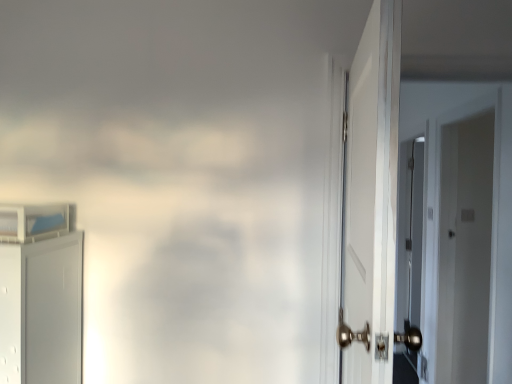
Question: Does white matte cabinet at left, the second door from the right, have a lesser width compared to white glossy door at right, the first door positioned from the right?

Choices:
 (A) yes
 (B) no

Answer: (B)

Question: Is white matte cabinet at left, the 1th door positioned from the left, smaller than white glossy door at right, which ranks as the 2th door in left-to-right order?

Choices:
 (A) no
 (B) yes

Answer: (B)

Question: Can you confirm if white matte cabinet at left, the 1th door positioned from the left, is positioned to the left of white glossy door at right, which ranks as the 2th door in left-to-right order?

Choices:
 (A) no
 (B) yes

Answer: (B)

Question: From a real-world perspective, is white matte cabinet at left, the second door from the right, below white glossy door at right, which ranks as the 2th door in left-to-right order?

Choices:
 (A) no
 (B) yes

Answer: (B)

Question: Can you confirm if white matte cabinet at left, the second door from the right, is bigger than white glossy door at right, which ranks as the 2th door in left-to-right order?

Choices:
 (A) yes
 (B) no

Answer: (B)

Question: Is white matte cabinet at left, the second door from the right, wider than white glossy door at right, the first door positioned from the right?

Choices:
 (A) yes
 (B) no

Answer: (A)

Question: From the image's perspective, is white glossy door at right, which ranks as the 2th door in left-to-right order, beneath white matte cabinet at left, the second door from the right?

Choices:
 (A) yes
 (B) no

Answer: (B)

Question: Is white glossy door at right, which ranks as the 2th door in left-to-right order, outside of white matte cabinet at left, the second door from the right?

Choices:
 (A) no
 (B) yes

Answer: (B)

Question: Considering the relative sizes of white glossy door at right, the first door positioned from the right, and white matte cabinet at left, the second door from the right, in the image provided, is white glossy door at right, the first door positioned from the right, thinner than white matte cabinet at left, the second door from the right,?

Choices:
 (A) yes
 (B) no

Answer: (A)

Question: Does white glossy door at right, the first door positioned from the right, have a smaller size compared to white matte cabinet at left, the 1th door positioned from the left?

Choices:
 (A) no
 (B) yes

Answer: (A)

Question: Does white glossy door at right, which ranks as the 2th door in left-to-right order, have a greater width compared to white matte cabinet at left, the second door from the right?

Choices:
 (A) no
 (B) yes

Answer: (A)

Question: Is white glossy door at right, which ranks as the 2th door in left-to-right order, surrounding white matte cabinet at left, the second door from the right?

Choices:
 (A) yes
 (B) no

Answer: (B)

Question: Is white glossy door at right, the first door positioned from the right, wider or thinner than white matte cabinet at left, the 1th door positioned from the left?

Choices:
 (A) wide
 (B) thin

Answer: (B)